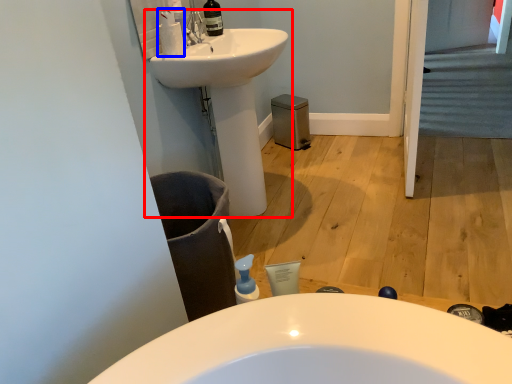
Question: Which of the following is the farthest to the observer, sink (highlighted by a red box) or cleaning product (highlighted by a blue box)?

Choices:
 (A) sink
 (B) cleaning product

Answer: (B)